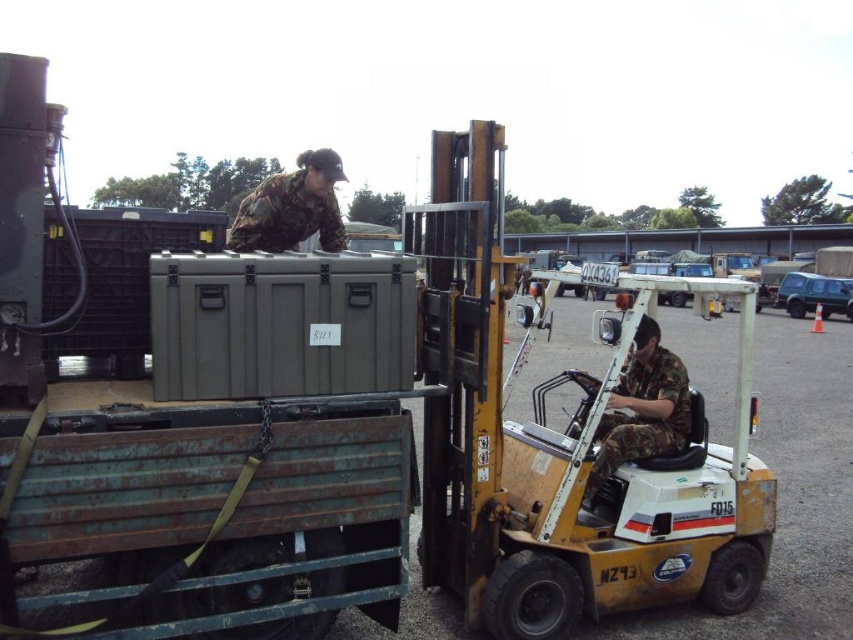
Is camouflage fabric uniform at center thinner than camouflage fabric uniform at upper center?

Correct, camouflage fabric uniform at center's width is less than camouflage fabric uniform at upper center's.

The height and width of the screenshot is (640, 853). Find the location of `camouflage fabric uniform at center`. camouflage fabric uniform at center is located at coordinates (642, 406).

Which is behind, point (624, 387) or point (254, 209)?

Positioned behind is point (624, 387).

Identify the location of camouflage fabric uniform at center. (642, 406).